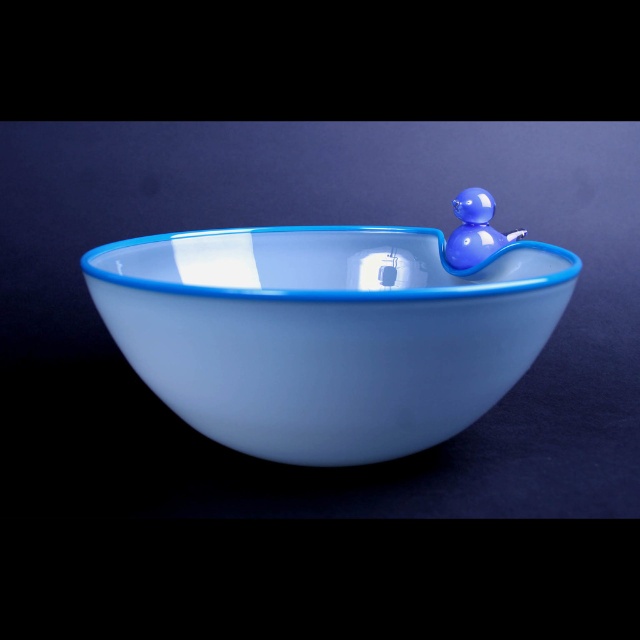
Question: Which object is farther from the camera taking this photo?

Choices:
 (A) glossy plastic duck at upper right
 (B) matte glass bowl at center

Answer: (A)

Question: Which point is farther to the camera?

Choices:
 (A) matte glass bowl at center
 (B) glossy plastic duck at upper right

Answer: (B)

Question: Does matte glass bowl at center appear over glossy plastic duck at upper right?

Choices:
 (A) yes
 (B) no

Answer: (B)

Question: Does matte glass bowl at center appear on the left side of glossy plastic duck at upper right?

Choices:
 (A) yes
 (B) no

Answer: (A)

Question: Can you confirm if matte glass bowl at center is positioned to the right of glossy plastic duck at upper right?

Choices:
 (A) yes
 (B) no

Answer: (B)